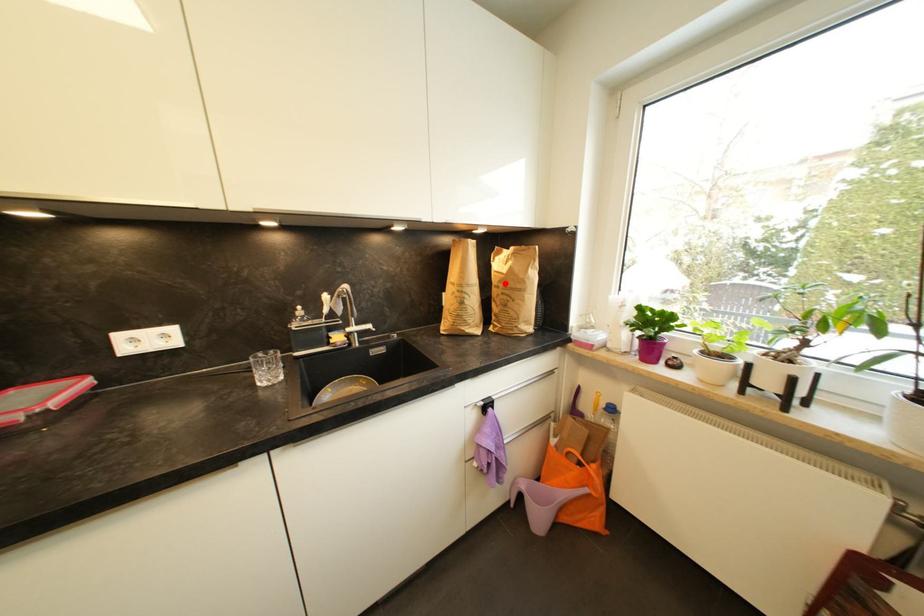
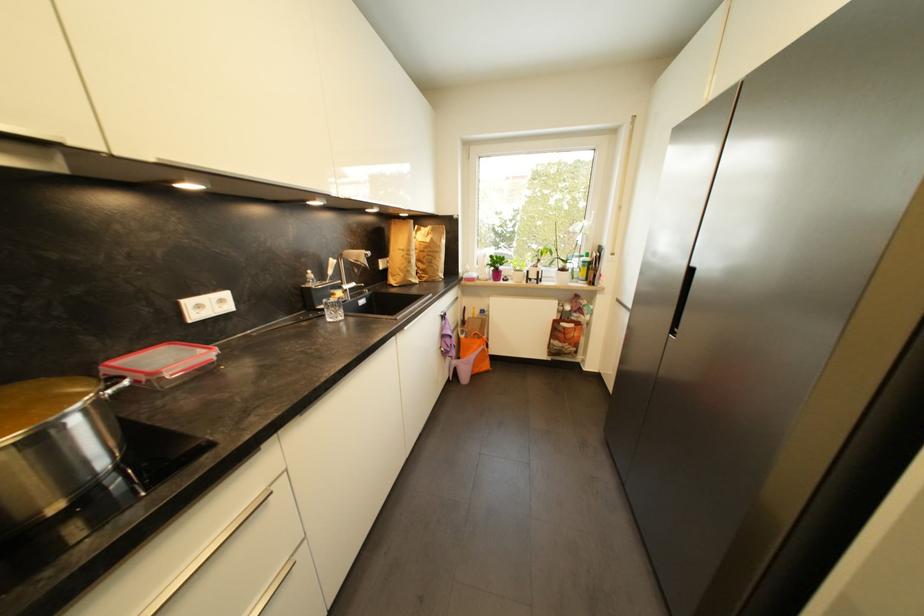
Locate, in the second image, the point that corresponds to the highlighted location in the first image.

(430, 249)